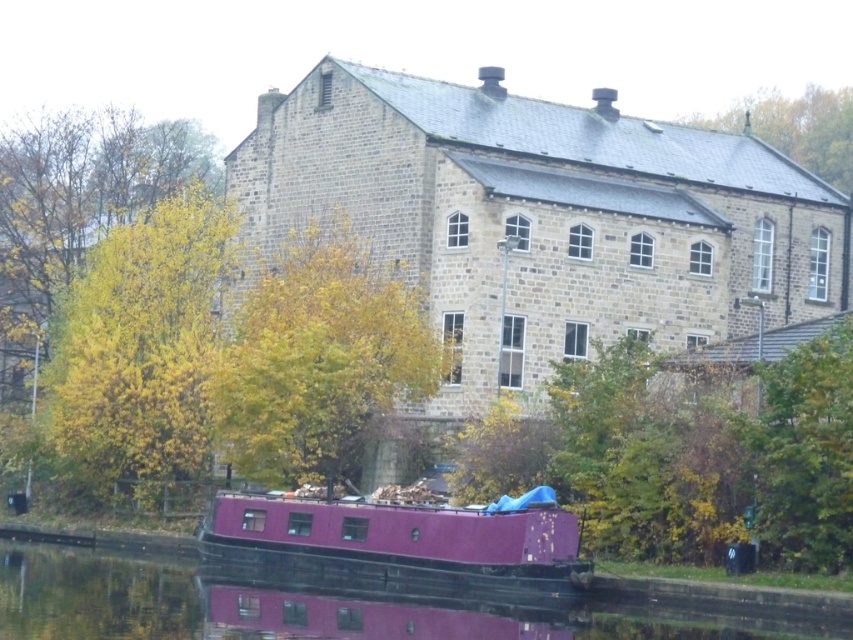
Does yellow leafy tree at left appear over purple glossy boat at lower center?

Yes, yellow leafy tree at left is above purple glossy boat at lower center.

What do you see at coordinates (141, 348) in the screenshot? The image size is (853, 640). I see `yellow leafy tree at left` at bounding box center [141, 348].

Locate an element on the screen. yellow leafy tree at left is located at coordinates (141, 348).

Between point (282, 481) and point (817, 100), which one is positioned in front?

Point (282, 481) is more forward.

Is point (311, 320) less distant than point (834, 104)?

That is True.

This screenshot has height=640, width=853. I want to click on yellow leafy tree at center, so click(318, 358).

Does yellow leafy tree at left appear under purple matte barge at lower center?

Actually, yellow leafy tree at left is above purple matte barge at lower center.

Does point (138, 444) lie in front of point (287, 497)?

No, it is not.

This screenshot has width=853, height=640. I want to click on yellow leafy tree at left, so click(141, 348).